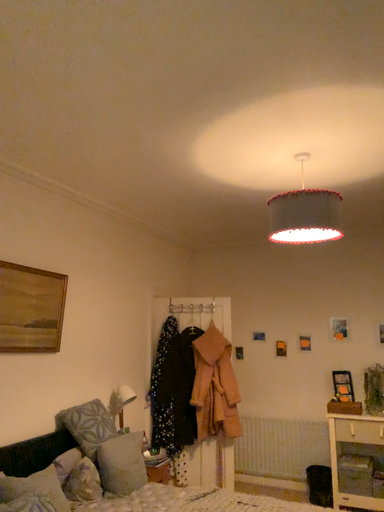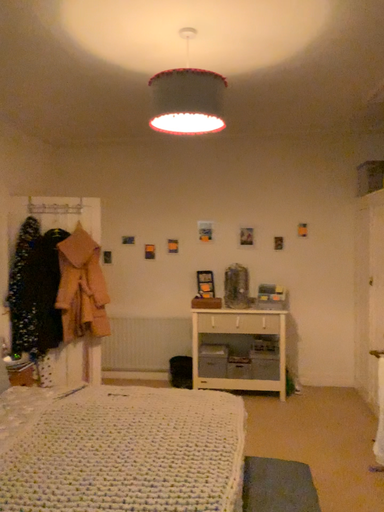
Question: Which way did the camera rotate in the video?

Choices:
 (A) rotated right
 (B) rotated left

Answer: (A)